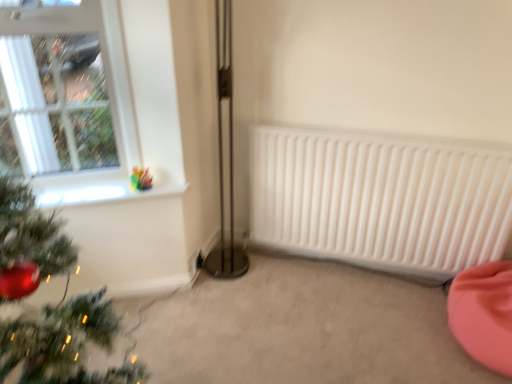
Question: From a real-world perspective, is white glass window at upper left positioned above or below pink fabric bean bag at lower right?

Choices:
 (A) above
 (B) below

Answer: (A)

Question: In terms of height, does white glass window at upper left look taller or shorter compared to pink fabric bean bag at lower right?

Choices:
 (A) short
 (B) tall

Answer: (B)

Question: Which object is the farthest from the translucent glass vase at upper left?

Choices:
 (A) pink fabric bean bag at lower right
 (B) white glass window at upper left

Answer: (A)

Question: Which of these objects is positioned closest to the pink fabric bean bag at lower right?

Choices:
 (A) translucent glass vase at upper left
 (B) white glass window at upper left

Answer: (A)